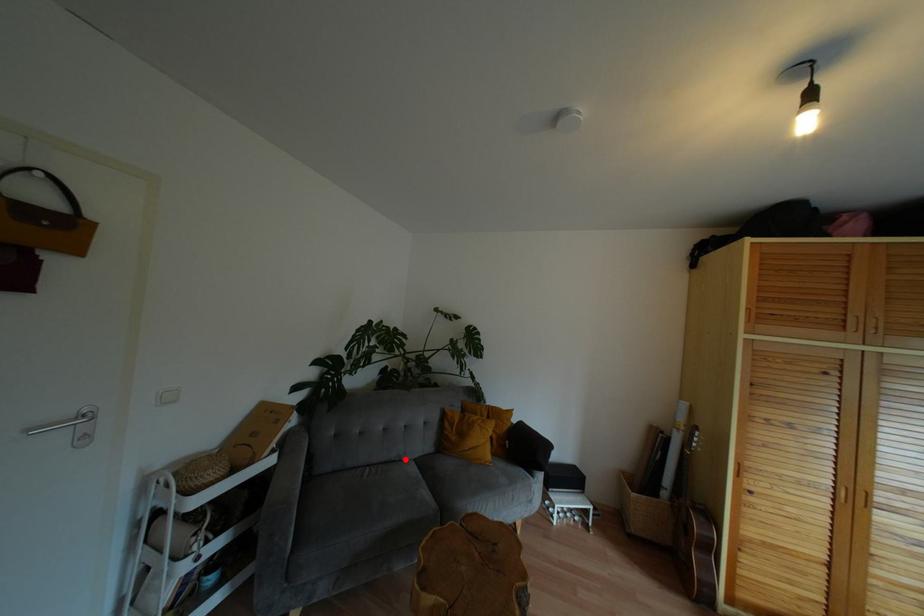
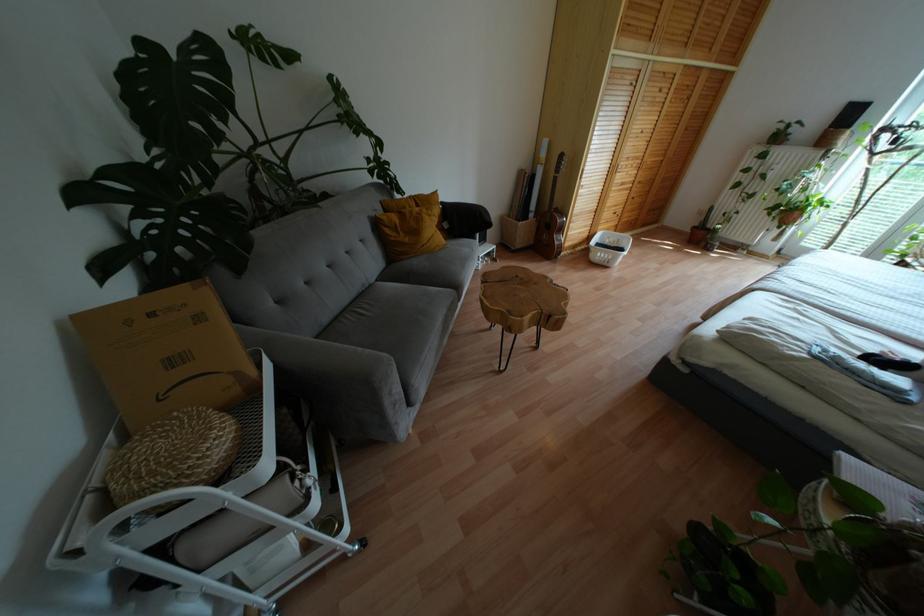
Locate, in the second image, the point that corresponds to the highlighted location in the first image.

(370, 284)